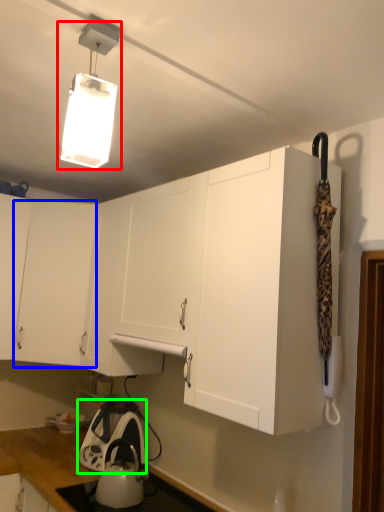
Question: Which is farther away from lamp (highlighted by a red box)? cabinetry (highlighted by a blue box) or appliance (highlighted by a green box)?

Choices:
 (A) cabinetry
 (B) appliance

Answer: (B)